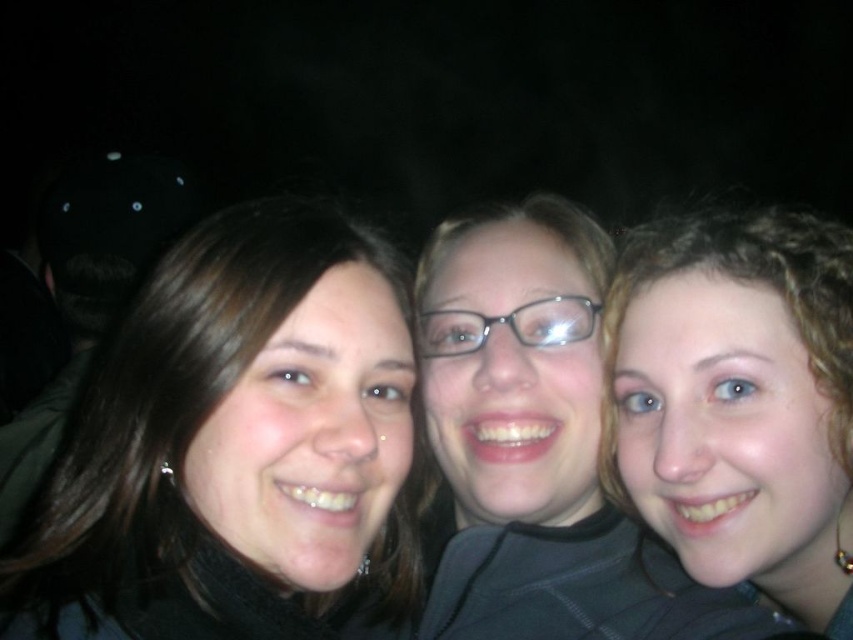
Does matte black hair at left appear under matte black glasses at center?

Correct, matte black hair at left is located below matte black glasses at center.

Which is more to the right, matte black hair at left or matte black glasses at center?

matte black glasses at center

Is point (198, 403) positioned in front of point (521, 545)?

Yes, it is.

Locate an element on the screen. The image size is (853, 640). matte black hair at left is located at coordinates (233, 444).

Describe the element at coordinates (737, 401) in the screenshot. Image resolution: width=853 pixels, height=640 pixels. I see `curly hair at right` at that location.

Identify the location of curly hair at right. pos(737,401).

The image size is (853, 640). What are the coordinates of `curly hair at right` in the screenshot? It's located at (737, 401).

Is matte black hair at left to the left of curly hair at right from the viewer's perspective?

Correct, you'll find matte black hair at left to the left of curly hair at right.

Is matte black hair at left smaller than curly hair at right?

Yes, matte black hair at left is smaller than curly hair at right.

Between point (329, 458) and point (827, 596), which one is positioned in front?

Point (329, 458) is more forward.

The height and width of the screenshot is (640, 853). Find the location of `matte black hair at left`. matte black hair at left is located at coordinates (233, 444).